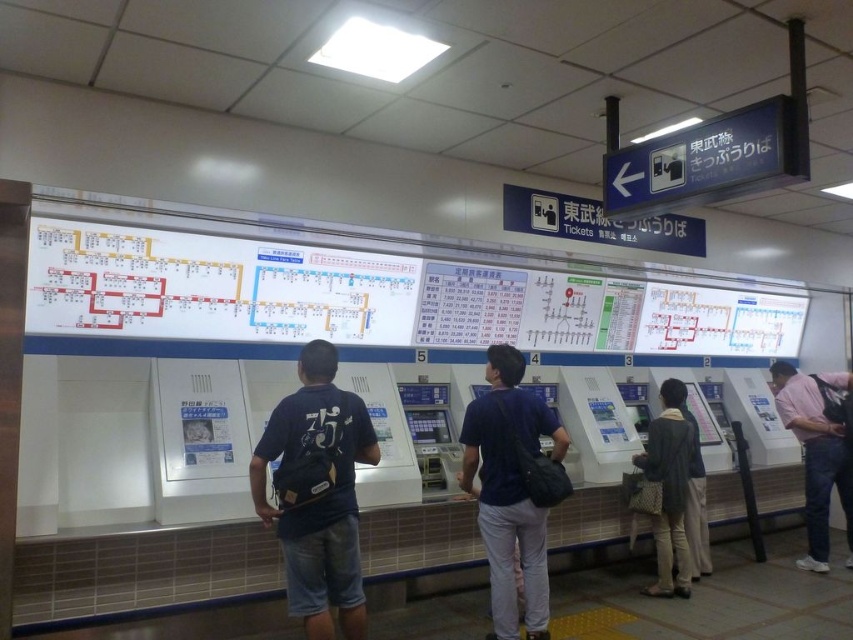
In the scene shown: Between pink cotton shirt at right and beige fabric jacket at center, which one is positioned lower?

beige fabric jacket at center is lower down.

Who is higher up, pink cotton shirt at right or beige fabric jacket at center?

pink cotton shirt at right is higher up.

Which is in front, point (822, 540) or point (677, 452)?

Point (677, 452)

Where is `pink cotton shirt at right`? This screenshot has width=853, height=640. pink cotton shirt at right is located at coordinates (816, 454).

You are a GUI agent. You are given a task and a screenshot of the screen. Output one action in this format:
    pyautogui.click(x=<x>, y=<y>)
    Task: Click on the dark blue shirt at center
    This screenshot has width=853, height=640.
    Given the screenshot: What is the action you would take?
    pyautogui.click(x=509, y=488)

Can you confirm if dark blue shirt at center is positioned to the right of pink cotton shirt at right?

No, dark blue shirt at center is not to the right of pink cotton shirt at right.

Find the location of a particular element. Image resolution: width=853 pixels, height=640 pixels. dark blue shirt at center is located at coordinates (509, 488).

Does dark blue backpack at center appear on the right side of dark blue shirt at center?

Incorrect, dark blue backpack at center is not on the right side of dark blue shirt at center.

Who is shorter, dark blue backpack at center or dark blue shirt at center?

dark blue backpack at center

Where is `dark blue backpack at center`? dark blue backpack at center is located at coordinates (318, 497).